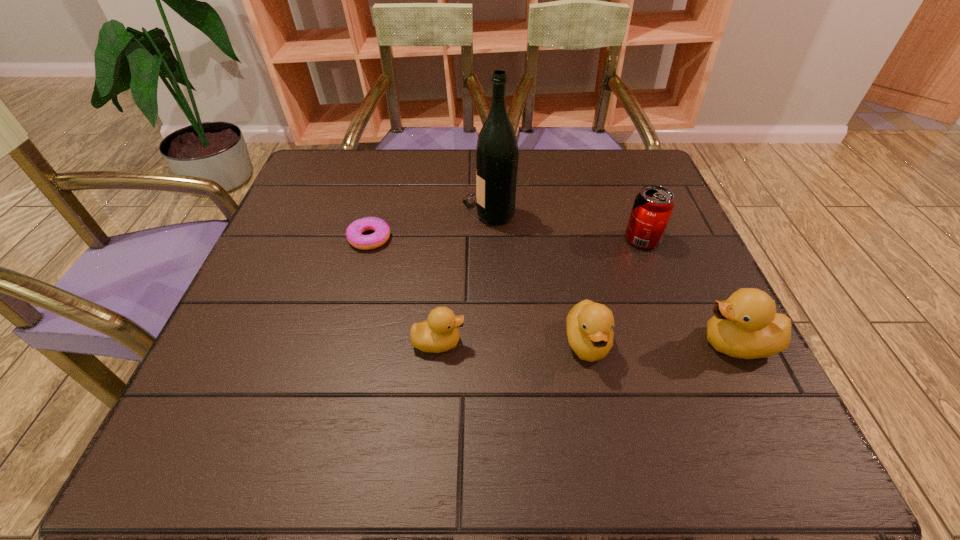
Find the location of a particular element. This screenshot has height=540, width=960. object present at the near right corner is located at coordinates (746, 325).

In the image, there is a desktop. Where is `blank space at the far edge`? The image size is (960, 540). blank space at the far edge is located at coordinates (372, 192).

Find the location of a particular element. The image size is (960, 540). free space at the left edge is located at coordinates (274, 274).

Image resolution: width=960 pixels, height=540 pixels. In the image, there is a desktop. Find the location of `free space at the right edge`. free space at the right edge is located at coordinates (666, 287).

At what (x,y) coordinates should I click in order to perform the action: click on vacant space at the far left corner of the desktop. Please return your answer as a coordinate pair (x, y). This screenshot has width=960, height=540. Looking at the image, I should click on (347, 170).

Locate an element on the screen. The width and height of the screenshot is (960, 540). vacant space at the far right corner of the desktop is located at coordinates (596, 170).

You are a GUI agent. You are given a task and a screenshot of the screen. Output one action in this format:
    pyautogui.click(x=<x>, y=<y>)
    Task: Click on the free point between the tallest duckling and the shortest object
    
    Given the screenshot: What is the action you would take?
    pyautogui.click(x=553, y=291)

What are the coordinates of `vacant space in between the soda can and the third object from right to left` in the screenshot? It's located at (614, 291).

Identify the location of vacant space in between the second shortest object and the soda can. (540, 291).

Find the location of a particular element. This screenshot has width=960, height=540. vacant region between the leftmost object and the soda can is located at coordinates (506, 239).